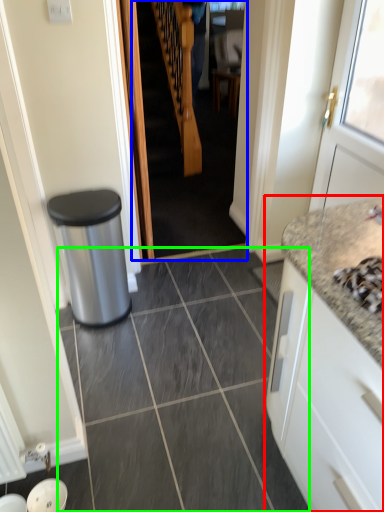
Question: Considering the real-world distances, which object is farthest from cabinetry (highlighted by a red box)? stairwell (highlighted by a blue box) or granite (highlighted by a green box)?

Choices:
 (A) stairwell
 (B) granite

Answer: (A)